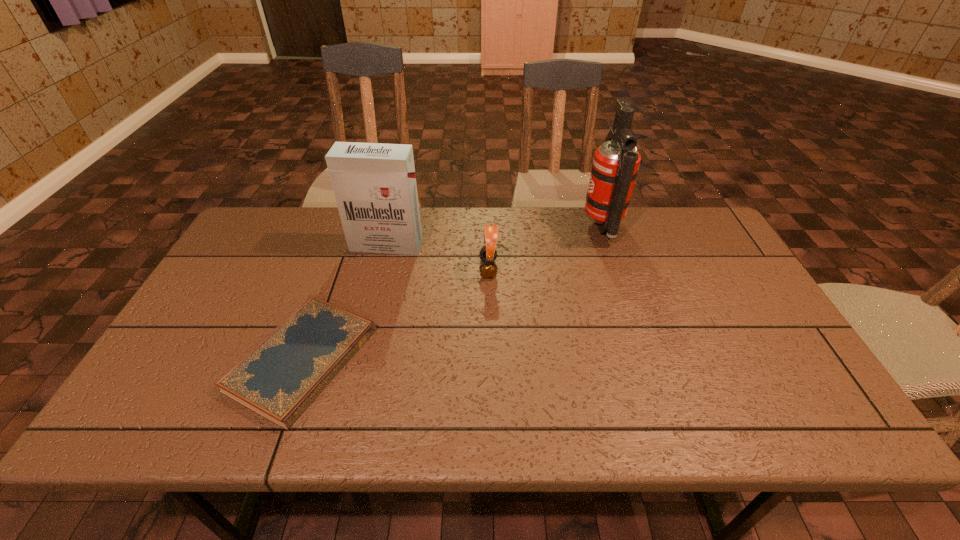
Locate an element on the screen. The image size is (960, 540). the tallest object is located at coordinates (615, 165).

Identify the location of the rightmost object. (615, 165).

Locate an element on the screen. cigarette case is located at coordinates (374, 184).

You are a GUI agent. You are given a task and a screenshot of the screen. Output one action in this format:
    pyautogui.click(x=<x>, y=<y>)
    Task: Click on the second object from right to left
    This screenshot has width=960, height=540.
    Given the screenshot: What is the action you would take?
    pyautogui.click(x=488, y=270)

Image resolution: width=960 pixels, height=540 pixels. I want to click on the second shortest object, so click(x=488, y=270).

Where is `paperback book`? Image resolution: width=960 pixels, height=540 pixels. paperback book is located at coordinates (282, 375).

Locate an element on the screen. The height and width of the screenshot is (540, 960). the shortest object is located at coordinates (282, 375).

Image resolution: width=960 pixels, height=540 pixels. What are the coordinates of `free space located 0.180m on the front label side of the tallest object` in the screenshot? It's located at (528, 227).

Locate an element on the screen. The width and height of the screenshot is (960, 540). free location located 0.230m on the front label side of the tallest object is located at coordinates pyautogui.click(x=513, y=227).

Find the location of a particular element. Image resolution: width=960 pixels, height=540 pixels. free space located on the front label side of the tallest object is located at coordinates (472, 227).